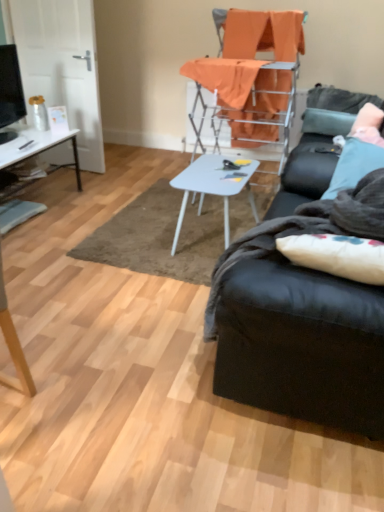
This screenshot has width=384, height=512. What do you see at coordinates (250, 77) in the screenshot?
I see `orange fabric chair at upper center` at bounding box center [250, 77].

In order to face white glossy desk at left, should I rotate leftwards or rightwards?

You should look left and rotate roughly 24.792 degrees.

Find the location of a particular element. white glossy desk at left is located at coordinates (37, 148).

What do you see at coordinates (305, 231) in the screenshot?
I see `dark gray plush blanket at right` at bounding box center [305, 231].

What is the approximate height of black leather couch at right?

black leather couch at right is 34.06 inches in height.

The image size is (384, 512). Describe the element at coordinates (214, 187) in the screenshot. I see `white glossy table at center` at that location.

Image resolution: width=384 pixels, height=512 pixels. What do you see at coordinates (368, 117) in the screenshot?
I see `white soft pillow at right` at bounding box center [368, 117].

What are the coordinates of `orange fabric chair at upper center` in the screenshot? It's located at (250, 77).

Based on the photo, from the image's perspective, is white glossy desk at left positioned above or below orange fabric chair at upper center?

Based on their image positions, white glossy desk at left is located beneath orange fabric chair at upper center.

Is white glossy desk at left inside or outside of orange fabric chair at upper center?

white glossy desk at left is located beyond the bounds of orange fabric chair at upper center.

Can you tell me how much white glossy desk at left and orange fabric chair at upper center differ in facing direction?

The facing directions of white glossy desk at left and orange fabric chair at upper center are 177 degrees apart.

From a real-world perspective, does white glossy desk at left sit lower than orange fabric chair at upper center?

Indeed, from a real-world perspective, white glossy desk at left is positioned beneath orange fabric chair at upper center.

Is matte black tv at left bigger than white glossy desk at left?

No.

Can you tell me how much matte black tv at left and white glossy desk at left differ in facing direction?

There is a 3.32-degree angle between the facing directions of matte black tv at left and white glossy desk at left.

In the image, is matte black tv at left positioned in front of or behind white glossy desk at left?

Visually, matte black tv at left is located behind white glossy desk at left.

From a real-world perspective, is matte black tv at left located beneath white glossy desk at left?

No, from a real-world perspective, matte black tv at left is not under white glossy desk at left.

From the image's perspective, is white soft pillow at right above matte black tv at left?

Incorrect, from the image's perspective, white soft pillow at right is lower than matte black tv at left.

Considering the sizes of white soft pillow at right and matte black tv at left in the image, is white soft pillow at right taller or shorter than matte black tv at left?

Clearly, white soft pillow at right is shorter compared to matte black tv at left.

How distant is white soft pillow at right from matte black tv at left?

white soft pillow at right and matte black tv at left are 2.42 meters apart.

Which is behind, white soft pillow at right or matte black tv at left?

white soft pillow at right is more distant.

Can you confirm if orange fabric chair at upper center is smaller than dark gray plush blanket at right?

Incorrect, orange fabric chair at upper center is not smaller in size than dark gray plush blanket at right.

From the image's perspective, is orange fabric chair at upper center above or below dark gray plush blanket at right?

From the image's perspective, orange fabric chair at upper center appears above dark gray plush blanket at right.

Is orange fabric chair at upper center facing towards dark gray plush blanket at right?

No, orange fabric chair at upper center is not oriented towards dark gray plush blanket at right.

Is orange fabric chair at upper center touching dark gray plush blanket at right?

No, orange fabric chair at upper center is not touching dark gray plush blanket at right.

Is white soft pillow at right facing towards black leather couch at right?

No, white soft pillow at right is not turned towards black leather couch at right.

Is white soft pillow at right positioned far away from black leather couch at right?

Absolutely, white soft pillow at right is distant from black leather couch at right.

From a real-world perspective, which is physically above, white soft pillow at right or black leather couch at right?

From a 3D spatial view, white soft pillow at right is above.

Consider the image. Is white soft pillow at right positioned beyond the bounds of black leather couch at right?

white soft pillow at right is positioned outside black leather couch at right.

Is point (55, 138) positioned before point (205, 336)?

No, it is not.

From the image's perspective, is white glossy desk at left located beneath dark gray plush blanket at right?

Actually, white glossy desk at left appears above dark gray plush blanket at right in the image.

Which object is thinner, white glossy desk at left or dark gray plush blanket at right?

dark gray plush blanket at right is thinner.

Which of these two, white glossy desk at left or dark gray plush blanket at right, is smaller?

dark gray plush blanket at right is smaller.

Is white glossy desk at left inside the boundaries of black leather couch at right, or outside?

white glossy desk at left cannot be found inside black leather couch at right.

Is white glossy desk at left oriented towards black leather couch at right?

Yes, white glossy desk at left is facing black leather couch at right.

Who is bigger, white glossy desk at left or black leather couch at right?

Bigger between the two is black leather couch at right.

Where is `desk located underneath the orange fabric chair at upper center (from a real-world perspective)`? This screenshot has height=512, width=384. desk located underneath the orange fabric chair at upper center (from a real-world perspective) is located at coordinates (37, 148).

You are a GUI agent. You are given a task and a screenshot of the screen. Output one action in this format:
    pyautogui.click(x=<x>, y=<y>)
    Task: Click on the television located on the right of white glossy desk at left
    The height and width of the screenshot is (512, 384).
    Given the screenshot: What is the action you would take?
    pyautogui.click(x=10, y=87)

Based on their spatial positions, is white glossy desk at left or white soft pillow at right further from white glossy table at center?

Based on the image, white glossy desk at left appears to be further to white glossy table at center.

Estimate the real-world distances between objects in this image. Which object is closer to dark gray plush blanket at right, matte black tv at left or black leather couch at right?

black leather couch at right lies closer to dark gray plush blanket at right than the other object.

Considering their positions, is orange fabric chair at upper center positioned closer to matte black tv at left than white soft pillow at right?

orange fabric chair at upper center is closer to matte black tv at left.

Considering their positions, is white glossy table at center positioned closer to white glossy desk at left than white soft pillow at right?

white glossy table at center is positioned closer to the anchor white glossy desk at left.

When comparing their distances from white glossy desk at left, does white glossy table at center or black leather couch at right seem further?

The object further to white glossy desk at left is black leather couch at right.

Which object lies nearer to the anchor point white glossy table at center, black leather couch at right or white soft pillow at right?

white soft pillow at right.

Looking at the image, which one is located closer to white glossy desk at left, orange fabric chair at upper center or dark gray plush blanket at right?

Among the two, orange fabric chair at upper center is located nearer to white glossy desk at left.

Based on their spatial positions, is dark gray plush blanket at right or black leather couch at right closer to white glossy table at center?

The object closer to white glossy table at center is dark gray plush blanket at right.

Locate an element on the screen. This screenshot has height=512, width=384. blanket between white glossy desk at left and black leather couch at right is located at coordinates (305, 231).

You are a GUI agent. You are given a task and a screenshot of the screen. Output one action in this format:
    pyautogui.click(x=<x>, y=<y>)
    Task: Click on the chair situated between white glossy desk at left and dark gray plush blanket at right from left to right
    The width and height of the screenshot is (384, 512).
    Given the screenshot: What is the action you would take?
    pyautogui.click(x=250, y=77)

You are a GUI agent. You are given a task and a screenshot of the screen. Output one action in this format:
    pyautogui.click(x=<x>, y=<y>)
    Task: Click on the blanket between matte black tv at left and black leather couch at right in the horizontal direction
    
    Given the screenshot: What is the action you would take?
    pyautogui.click(x=305, y=231)

At what (x,y) coordinates should I click in order to perform the action: click on studio couch between white glossy desk at left and white soft pillow at right in the horizontal direction. Please return your answer as a coordinate pair (x, y). This screenshot has width=384, height=512. Looking at the image, I should click on (302, 344).